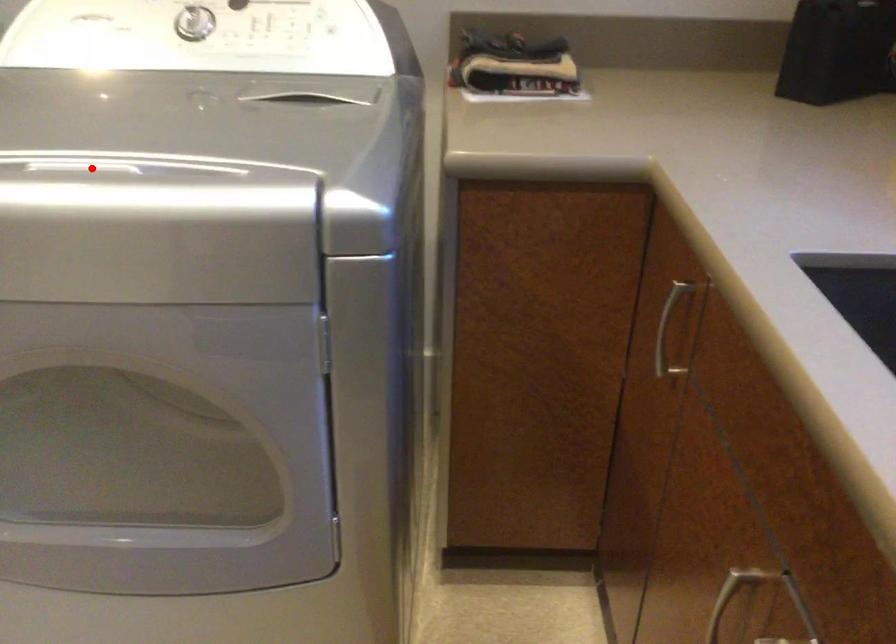
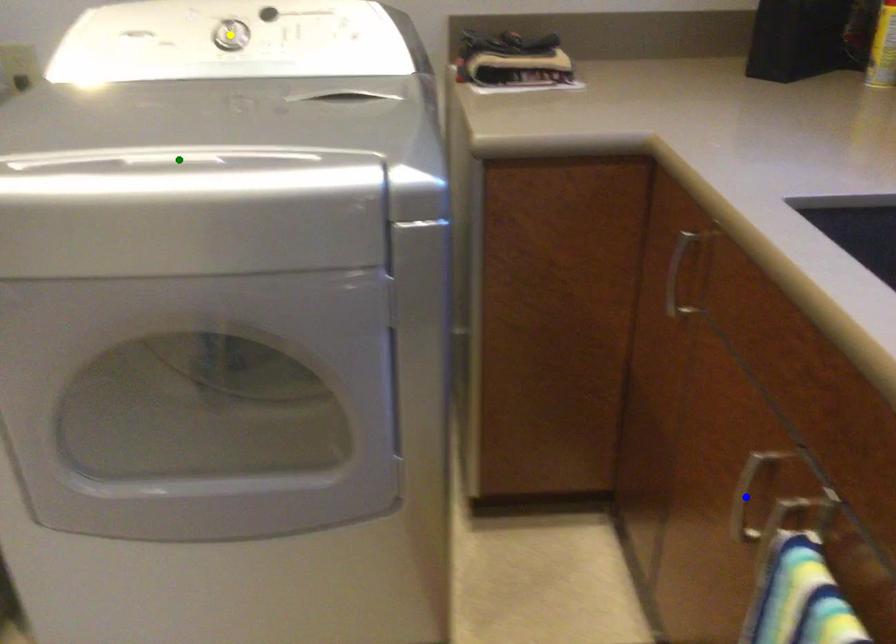
Question: I am providing you with two images of the same scene from different viewpoints. A red point is marked on the first image. You are given multiple points on the second image. Which mark in image 2 goes with the point in image 1?

Choices:
 (A) blue point
 (B) green point
 (C) yellow point

Answer: (B)